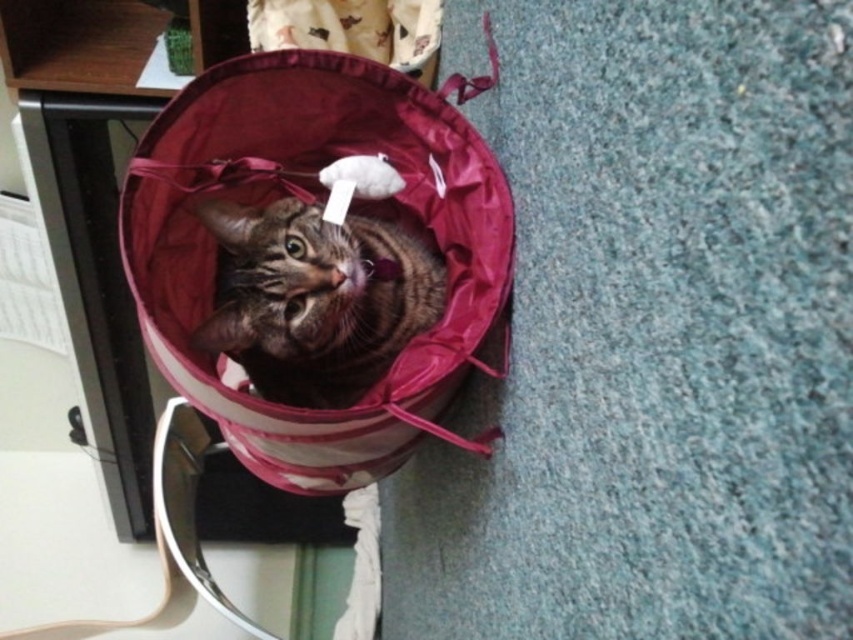
Does velvet-like maroon cat bed at center have a smaller size compared to tabby fur cat at center?

Actually, velvet-like maroon cat bed at center might be larger than tabby fur cat at center.

Who is more forward, (x=148, y=253) or (x=380, y=332)?

Point (x=148, y=253) is more forward.

Where is `velvet-like maroon cat bed at center`? The height and width of the screenshot is (640, 853). velvet-like maroon cat bed at center is located at coordinates (318, 198).